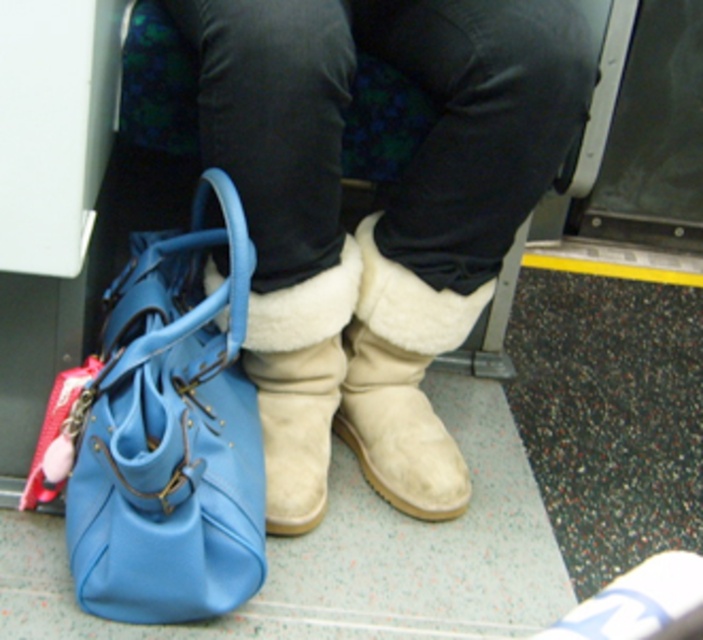
You are a passenger sitting in a public transportation vehicle. You notice a point marked at coordinates (375, 216). What object does this point correspond to?

The point at coordinates (375, 216) corresponds to the suede boots at center.